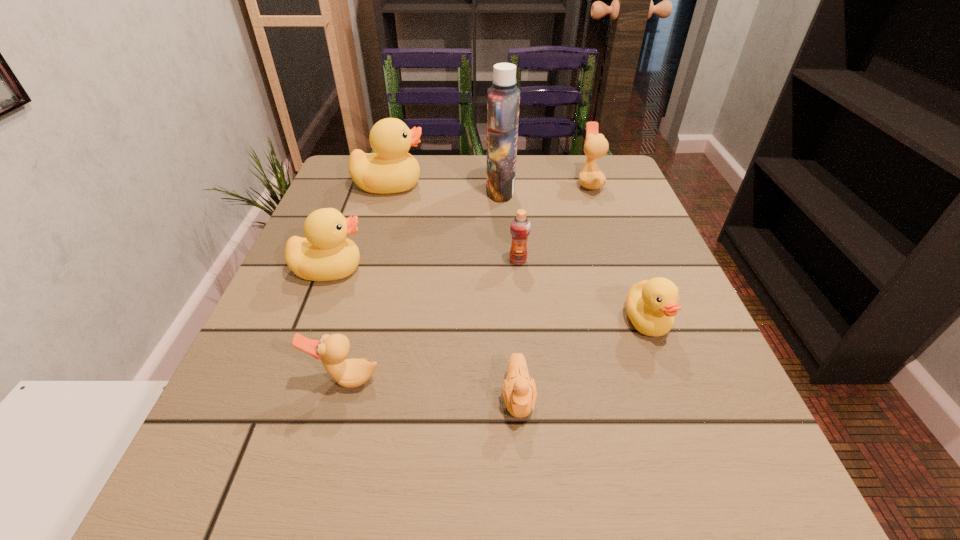
Identify which duck is the third closest to the shampoo. Please provide its 2D coordinates. Your answer should be formatted as a tuple, i.e. [(x, y)], where the tuple contains the x and y coordinates of a point satisfying the conditions above.

[(326, 254)]

The width and height of the screenshot is (960, 540). What are the coordinates of `yellow duck that can be found as the second closest to the nearer tan duck` in the screenshot? It's located at (651, 305).

The height and width of the screenshot is (540, 960). What are the coordinates of `the third closest yellow duck relative to the shampoo` in the screenshot? It's located at (651, 305).

Locate an element on the screen. vacant area in the image that satisfies the following two spatial constraints: 1. on the back side of the orange juice; 2. on the front label of the blue shampoo is located at coordinates (511, 191).

The height and width of the screenshot is (540, 960). In order to click on free spot that satisfies the following two spatial constraints: 1. on the front label of the blue shampoo; 2. on the left side of the orange juice in this screenshot , I will do `click(505, 260)`.

This screenshot has width=960, height=540. Find the location of `vacant space that satisfies the following two spatial constraints: 1. on the front side of the orange juice; 2. at the beak of the second farthest yellow duck`. vacant space that satisfies the following two spatial constraints: 1. on the front side of the orange juice; 2. at the beak of the second farthest yellow duck is located at coordinates (518, 269).